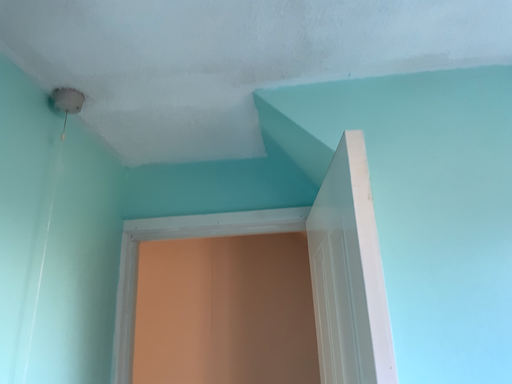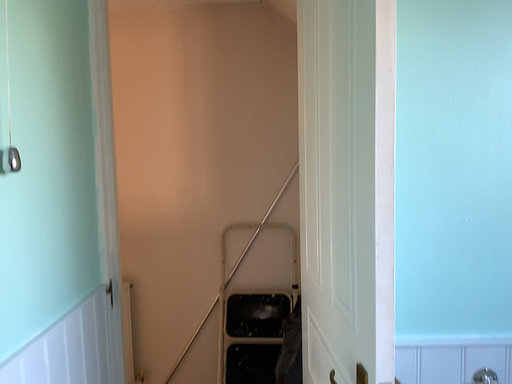
Question: Which way did the camera rotate in the video?

Choices:
 (A) rotated upward
 (B) rotated downward

Answer: (B)